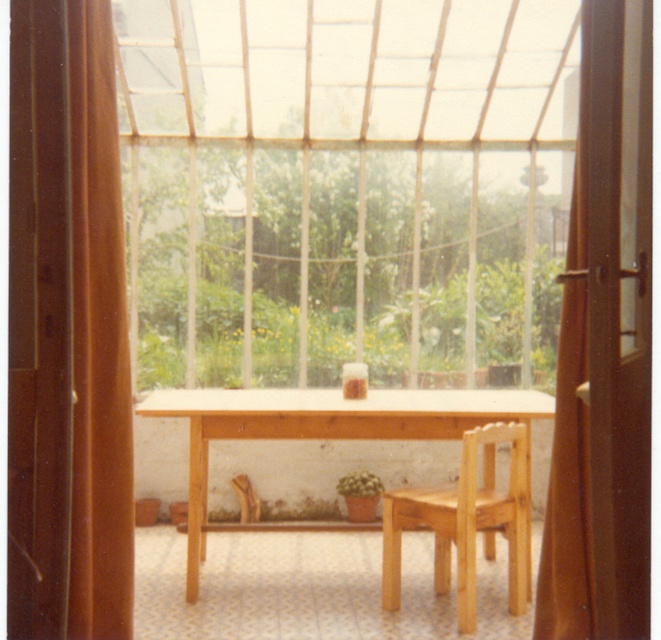
You are standing in the conservatory and want to look outside through the transparent glass window at center. Based on its position, where should you stand to ensure you can see the window clearly?

The transparent glass window at center is located at point (344, 188), so you should position yourself directly in front of that coordinate to have a clear view of the window.

You are standing in the conservatory and want to place a potted plant on the table. The transparent glass window at center and the green leafy plant at center are both in your way. Which one do you need to move first to access the table?

The transparent glass window at center is positioned over the green leafy plant at center, so you need to move the transparent glass window at center first to access the table.